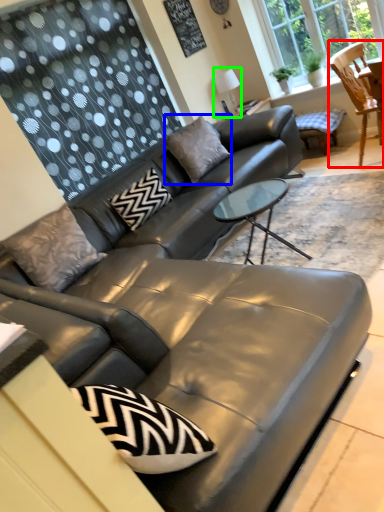
Question: Estimate the real-world distances between objects in this image. Which object is closer to chair (highlighted by a red box), pillow (highlighted by a blue box) or lamp (highlighted by a green box)?

Choices:
 (A) pillow
 (B) lamp

Answer: (A)